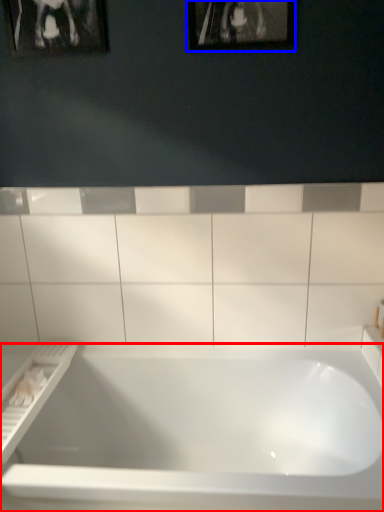
Question: Which of the following is the farthest to the observer, bathtub (highlighted by a red box) or picture frame (highlighted by a blue box)?

Choices:
 (A) bathtub
 (B) picture frame

Answer: (B)